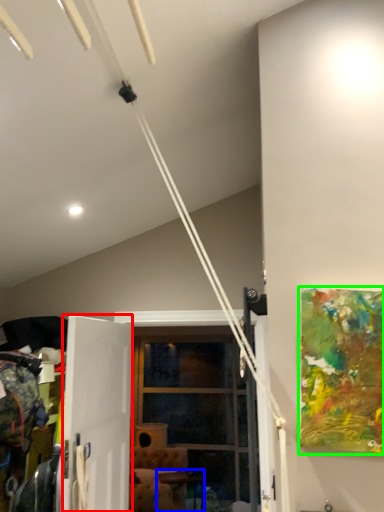
Question: Considering the real-world distances, which object is closest to screen door (highlighted by a red box)? table (highlighted by a blue box) or picture frame (highlighted by a green box).

Choices:
 (A) table
 (B) picture frame

Answer: (B)